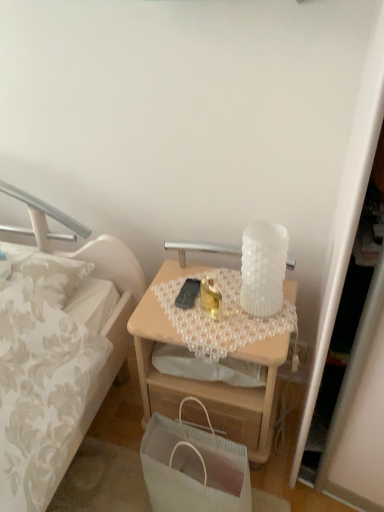
Question: Should I look upward or downward to see black matte mobile phone at center?

Choices:
 (A) up
 (B) down

Answer: (B)

Question: Does black matte mobile phone at center have a larger size compared to white ribbed paper bag at lower center?

Choices:
 (A) no
 (B) yes

Answer: (A)

Question: From a real-world perspective, is black matte mobile phone at center under white ribbed paper bag at lower center?

Choices:
 (A) yes
 (B) no

Answer: (B)

Question: Can you confirm if black matte mobile phone at center is positioned to the left of white ribbed paper bag at lower center?

Choices:
 (A) yes
 (B) no

Answer: (A)

Question: Does black matte mobile phone at center touch white ribbed paper bag at lower center?

Choices:
 (A) yes
 (B) no

Answer: (B)

Question: Does black matte mobile phone at center appear on the right side of white ribbed paper bag at lower center?

Choices:
 (A) yes
 (B) no

Answer: (B)

Question: Would you say black matte mobile phone at center is a long distance from white ribbed paper bag at lower center?

Choices:
 (A) yes
 (B) no

Answer: (B)

Question: From a real-world perspective, is light wood desk at center positioned over black matte mobile phone at center based on gravity?

Choices:
 (A) no
 (B) yes

Answer: (A)

Question: Is light wood desk at center wider than black matte mobile phone at center?

Choices:
 (A) no
 (B) yes

Answer: (B)

Question: Can you confirm if light wood desk at center is bigger than black matte mobile phone at center?

Choices:
 (A) no
 (B) yes

Answer: (B)

Question: Is light wood desk at center oriented away from black matte mobile phone at center?

Choices:
 (A) yes
 (B) no

Answer: (B)

Question: Is light wood desk at center surrounding black matte mobile phone at center?

Choices:
 (A) no
 (B) yes

Answer: (B)

Question: Is light wood desk at center taller than black matte mobile phone at center?

Choices:
 (A) yes
 (B) no

Answer: (A)

Question: From a real-world perspective, is white textured glass at upper center on black matte mobile phone at center?

Choices:
 (A) yes
 (B) no

Answer: (A)